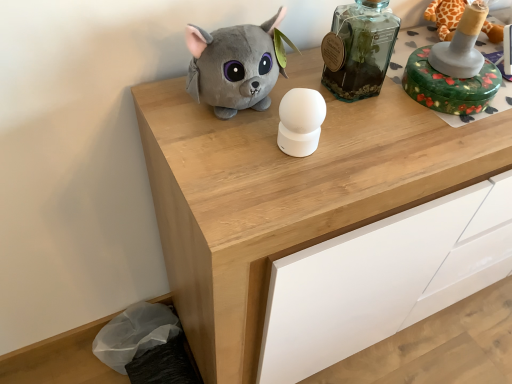
Question: Are wooden chest of drawers at center and transparent glass bottle at upper center making contact?

Choices:
 (A) no
 (B) yes

Answer: (A)

Question: Can you confirm if wooden chest of drawers at center is wider than transparent glass bottle at upper center?

Choices:
 (A) yes
 (B) no

Answer: (A)

Question: Can you confirm if wooden chest of drawers at center is smaller than transparent glass bottle at upper center?

Choices:
 (A) yes
 (B) no

Answer: (B)

Question: Is there a large distance between wooden chest of drawers at center and transparent glass bottle at upper center?

Choices:
 (A) no
 (B) yes

Answer: (A)

Question: From a real-world perspective, does wooden chest of drawers at center stand above transparent glass bottle at upper center?

Choices:
 (A) no
 (B) yes

Answer: (A)

Question: Is point (463, 18) positioned closer to the camera than point (437, 119)?

Choices:
 (A) farther
 (B) closer

Answer: (B)

Question: From a real-world perspective, relative to wooden chest of drawers at center, is green floral-patterned box at upper right, which is counted as the second toy, starting from the left, vertically above or below?

Choices:
 (A) below
 (B) above

Answer: (B)

Question: Would you say green floral-patterned box at upper right, which is counted as the second toy, starting from the left, is to the left or to the right of wooden chest of drawers at center in the picture?

Choices:
 (A) left
 (B) right

Answer: (A)

Question: Is green floral-patterned box at upper right, the 1th toy when ordered from right to left, spatially inside wooden chest of drawers at center, or outside of it?

Choices:
 (A) outside
 (B) inside

Answer: (A)

Question: From a real-world perspective, is green floral-patterned box at upper right, which is counted as the second toy, starting from the left, above or below soft plush cat at upper center, positioned as the 2th toy in right-to-left order?

Choices:
 (A) below
 (B) above

Answer: (A)

Question: From the image's perspective, is green floral-patterned box at upper right, which is counted as the second toy, starting from the left, located above or below soft plush cat at upper center, which is the 1th toy in left-to-right order?

Choices:
 (A) below
 (B) above

Answer: (B)

Question: Considering their positions, is green floral-patterned box at upper right, the 1th toy when ordered from right to left, located in front of or behind soft plush cat at upper center, which is the 1th toy in left-to-right order?

Choices:
 (A) front
 (B) behind

Answer: (B)

Question: Considering the positions of green floral-patterned box at upper right, the 1th toy when ordered from right to left, and soft plush cat at upper center, which is the 1th toy in left-to-right order, in the image, is green floral-patterned box at upper right, the 1th toy when ordered from right to left, wider or thinner than soft plush cat at upper center, which is the 1th toy in left-to-right order,?

Choices:
 (A) thin
 (B) wide

Answer: (B)

Question: From the image's perspective, relative to transparent glass bottle at upper center, is wooden chest of drawers at center above or below?

Choices:
 (A) above
 (B) below

Answer: (B)

Question: Considering the positions of wooden chest of drawers at center and transparent glass bottle at upper center in the image, is wooden chest of drawers at center wider or thinner than transparent glass bottle at upper center?

Choices:
 (A) thin
 (B) wide

Answer: (B)